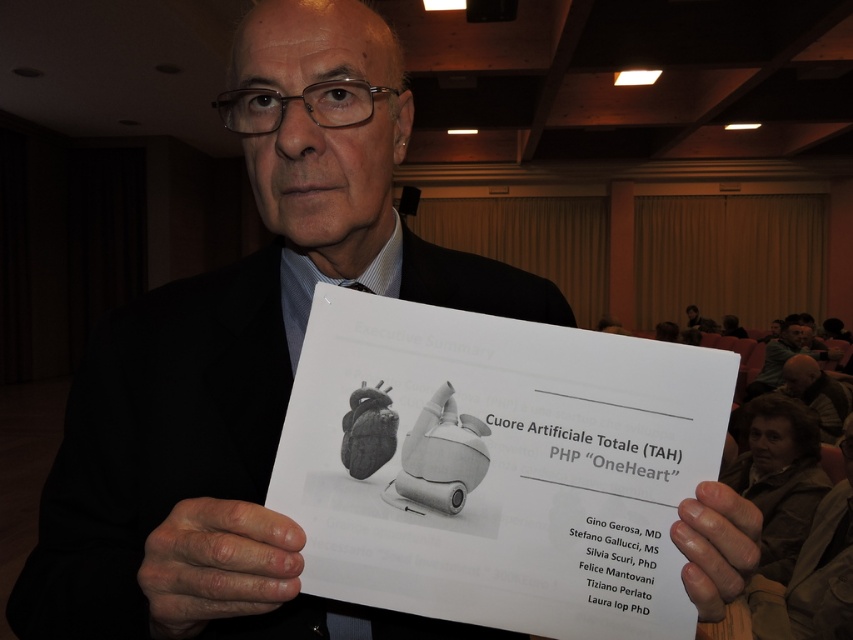
You are an attendee at the conference and you want to approach the speaker. You see the brown leather jacket at lower right and the gray hair at upper right. Which object is closer to the speaker?

The brown leather jacket at lower right is located below the gray hair at upper right, so the gray hair at upper right is closer to the speaker.

You are a medical student observing a presentation about artificial hearts. The presenter is holding a slide with two skin samples labeled as dry skin at center and smooth skin at center. If you need to place a medical device that requires 12 inches of space between the two skin samples, is the current distance sufficient?

The dry skin at center is 11.57 inches from smooth skin at center. Since 11.57 inches is less than the required 12 inches, the current distance is insufficient for placing the medical device.

You are a medical student observing a presentation slide comparing two types of heart tissue samples. The slide shows a dry skin at center and a smooth skin at center. Your professor asks you to identify which sample has a larger area based on the slide. Which one do you choose?

The dry skin at center is larger in size than the smooth skin at center, so the dry skin at center has a larger area.